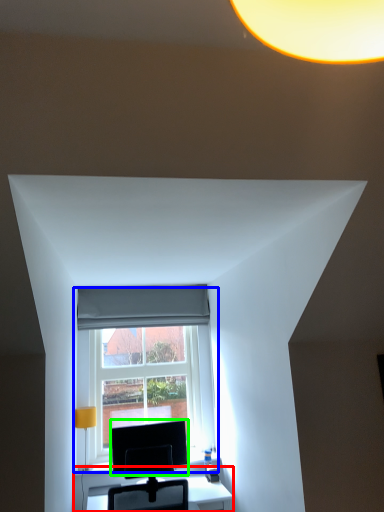
Question: Which object is positioned closest to table (highlighted by a red box)? Select from window (highlighted by a blue box) and computer monitor (highlighted by a green box).

Choices:
 (A) window
 (B) computer monitor

Answer: (B)